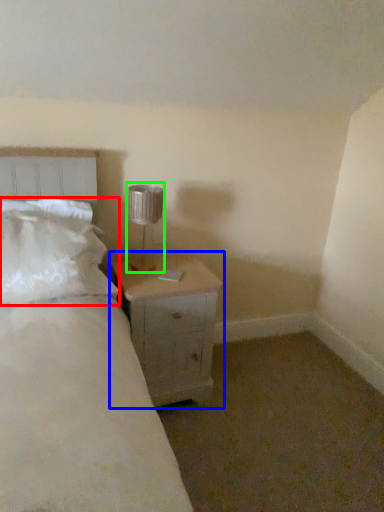
Question: Which object is positioned closest to pillow (highlighted by a red box)? Select from nightstand (highlighted by a blue box) and lamp (highlighted by a green box).

Choices:
 (A) nightstand
 (B) lamp

Answer: (A)